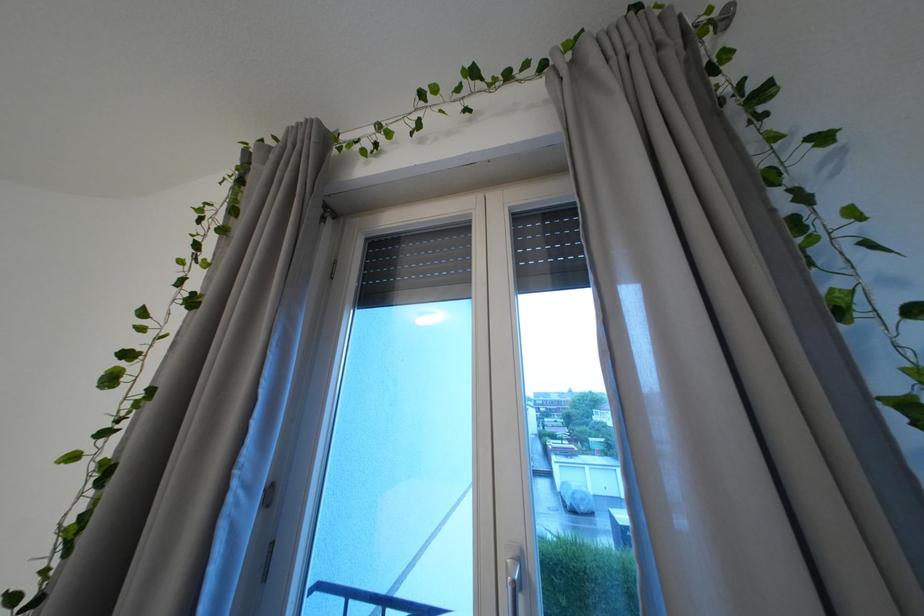
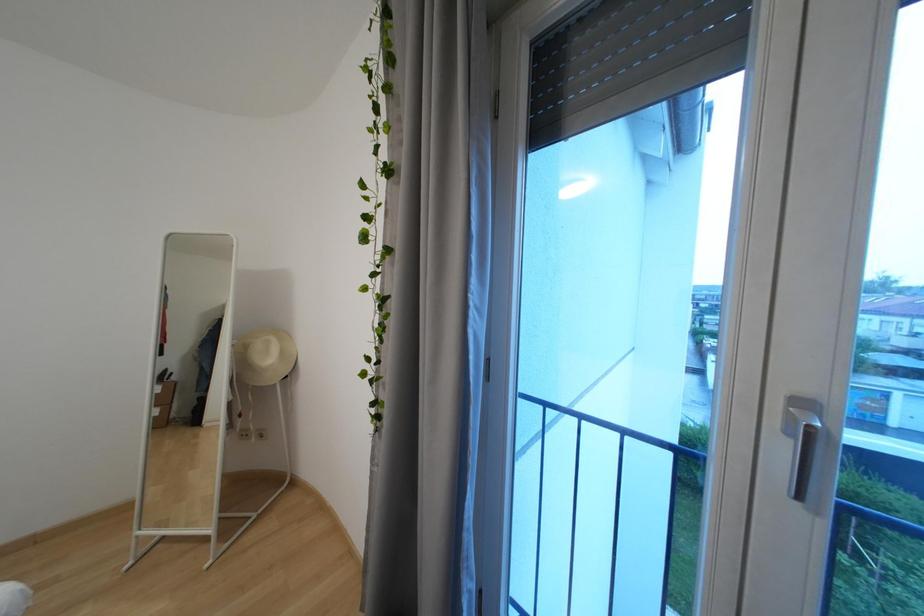
Based on the continuous images, in which direction is the camera rotating?

The rotation direction of the camera is left-down.